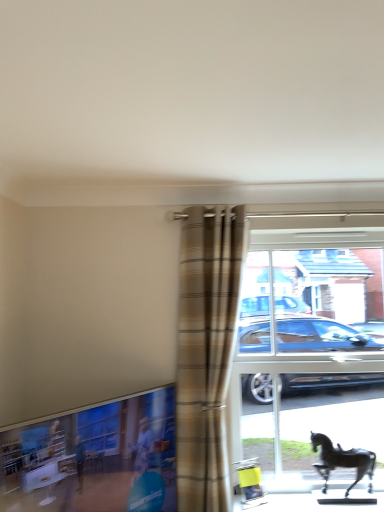
The height and width of the screenshot is (512, 384). In order to click on plaid fabric curtain at center in this screenshot , I will do `click(206, 351)`.

This screenshot has height=512, width=384. Describe the element at coordinates (92, 458) in the screenshot. I see `clear glass window at lower left` at that location.

The height and width of the screenshot is (512, 384). I want to click on plaid fabric curtain at center, so (206, 351).

From a real-world perspective, is plaid fabric curtain at center physically below transparent glass horse at right?

Incorrect, from a real-world perspective, plaid fabric curtain at center is higher than transparent glass horse at right.

This screenshot has height=512, width=384. Identify the location of curtain on the left of transparent glass horse at right. (206, 351).

In terms of height, does plaid fabric curtain at center look taller or shorter compared to transparent glass horse at right?

Considering their sizes, plaid fabric curtain at center has more height than transparent glass horse at right.

Which object is thinner, plaid fabric curtain at center or transparent glass horse at right?

Thinner between the two is transparent glass horse at right.

From the image's perspective, which object appears higher, plaid fabric curtain at center or clear glass window at lower left?

plaid fabric curtain at center, from the image's perspective.

Is plaid fabric curtain at center facing towards clear glass window at lower left?

No, plaid fabric curtain at center is not turned towards clear glass window at lower left.

Where is `curtain on the right of clear glass window at lower left`? curtain on the right of clear glass window at lower left is located at coordinates (206, 351).

Is point (213, 392) farther from viewer compared to point (17, 490)?

Yes, point (213, 392) is behind point (17, 490).

From the image's perspective, would you say clear glass window at lower left is positioned over transparent glass horse at right?

No, from the image's perspective, clear glass window at lower left is not over transparent glass horse at right.

Is clear glass window at lower left positioned beyond the bounds of transparent glass horse at right?

Indeed, clear glass window at lower left is completely outside transparent glass horse at right.

Which is behind, clear glass window at lower left or transparent glass horse at right?

transparent glass horse at right is further away from the camera.

Looking at this image, in terms of width, does shiny black horse at lower right look wider or thinner when compared to plaid fabric curtain at center?

In the image, shiny black horse at lower right appears to be more narrow than plaid fabric curtain at center.

From the picture: Could you tell me if shiny black horse at lower right is facing plaid fabric curtain at center?

No, shiny black horse at lower right is not facing towards plaid fabric curtain at center.

Consider the image. Can you tell me how much shiny black horse at lower right and plaid fabric curtain at center differ in facing direction?

There is a 2.82-degree angle between the facing directions of shiny black horse at lower right and plaid fabric curtain at center.

Between shiny black horse at lower right and plaid fabric curtain at center, which one has smaller size?

shiny black horse at lower right.

Considering the relative sizes of transparent glass horse at right and clear glass window at lower left in the image provided, is transparent glass horse at right taller than clear glass window at lower left?

Yes.

From a real-world perspective, is transparent glass horse at right on top of clear glass window at lower left?

Yes, from a real-world perspective, transparent glass horse at right is over clear glass window at lower left

Is point (252, 386) closer to viewer compared to point (32, 499)?

No, (252, 386) is behind (32, 499).

Based on the photo, between transparent glass horse at right and clear glass window at lower left, which one appears on the right side from the viewer's perspective?

transparent glass horse at right is more to the right.

Image resolution: width=384 pixels, height=512 pixels. Find the location of `horse lying on the right of transparent glass horse at right`. horse lying on the right of transparent glass horse at right is located at coordinates (342, 460).

From the image's perspective, is shiny black horse at lower right positioned above or below transparent glass horse at right?

From the image's perspective, shiny black horse at lower right appears below transparent glass horse at right.

Does shiny black horse at lower right touch transparent glass horse at right?

No, shiny black horse at lower right is not making contact with transparent glass horse at right.

Is transparent glass horse at right not close to plaid fabric curtain at center?

Actually, transparent glass horse at right and plaid fabric curtain at center are a little close together.

Does transparent glass horse at right have a lesser height compared to plaid fabric curtain at center?

Yes, transparent glass horse at right is shorter than plaid fabric curtain at center.

Where is `window on the right side of plaid fabric curtain at center`? This screenshot has width=384, height=512. window on the right side of plaid fabric curtain at center is located at coordinates (282, 342).

From a real-world perspective, is transparent glass horse at right located higher than plaid fabric curtain at center?

No, from a real-world perspective, transparent glass horse at right is not on top of plaid fabric curtain at center.

This screenshot has width=384, height=512. In the image, there is a plaid fabric curtain at center. In order to click on window below it (from a real-world perspective) in this screenshot , I will do `click(282, 342)`.

Where is `curtain above the clear glass window at lower left (from the image's perspective)`? curtain above the clear glass window at lower left (from the image's perspective) is located at coordinates (206, 351).

Which object lies further to the anchor point clear glass window at lower left, plaid fabric curtain at center or transparent glass horse at right?

transparent glass horse at right is further to clear glass window at lower left.

Based on their spatial positions, is shiny black horse at lower right or transparent glass horse at right further from plaid fabric curtain at center?

shiny black horse at lower right is positioned further to the anchor plaid fabric curtain at center.

When comparing their distances from transparent glass horse at right, does shiny black horse at lower right or clear glass window at lower left seem further?

clear glass window at lower left is further to transparent glass horse at right.

Which object lies nearer to the anchor point plaid fabric curtain at center, shiny black horse at lower right or clear glass window at lower left?

clear glass window at lower left is positioned closer to the anchor plaid fabric curtain at center.

Considering their positions, is clear glass window at lower left positioned further to plaid fabric curtain at center than transparent glass horse at right?

Based on the image, transparent glass horse at right appears to be further to plaid fabric curtain at center.

Based on their spatial positions, is shiny black horse at lower right or plaid fabric curtain at center further from clear glass window at lower left?

shiny black horse at lower right lies further to clear glass window at lower left than the other object.

Estimate the real-world distances between objects in this image. Which object is closer to plaid fabric curtain at center, clear glass window at lower left or shiny black horse at lower right?

clear glass window at lower left is closer to plaid fabric curtain at center.

Which object lies further to the anchor point transparent glass horse at right, clear glass window at lower left or plaid fabric curtain at center?

clear glass window at lower left is positioned further to the anchor transparent glass horse at right.

At what (x,y) coordinates should I click in order to perform the action: click on window between plaid fabric curtain at center and shiny black horse at lower right from left to right. Please return your answer as a coordinate pair (x, y). The width and height of the screenshot is (384, 512). Looking at the image, I should click on (282, 342).

Identify the location of curtain between clear glass window at lower left and shiny black horse at lower right. The height and width of the screenshot is (512, 384). (206, 351).

Where is `curtain between clear glass window at lower left and transparent glass horse at right`? curtain between clear glass window at lower left and transparent glass horse at right is located at coordinates (206, 351).

Locate an element on the screen. The image size is (384, 512). window between clear glass window at lower left and shiny black horse at lower right is located at coordinates (282, 342).